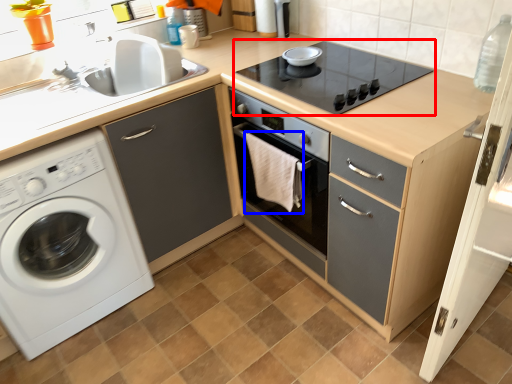
Question: Among these objects, which one is nearest to the camera, gas stove (highlighted by a red box) or material (highlighted by a blue box)?

Choices:
 (A) gas stove
 (B) material

Answer: (A)